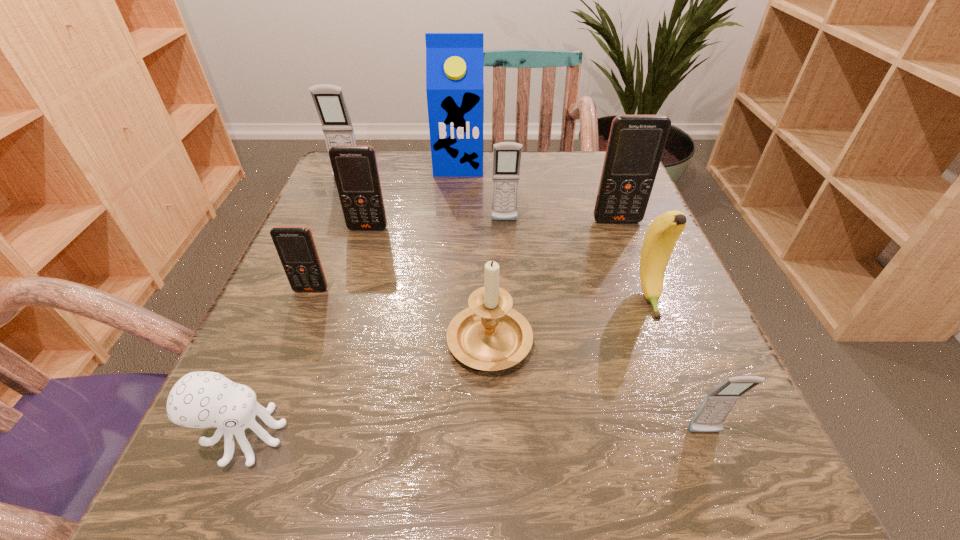
Image resolution: width=960 pixels, height=540 pixels. Identify the location of vacant area that lies between the sixth nearest object and the nearest gray cellular telephone. (537, 330).

Locate an element on the screen. The height and width of the screenshot is (540, 960). vacant area that lies between the farthest cellular telephone and the nearest orange cellular telephone is located at coordinates (329, 235).

Find the location of `vacant space that is in between the banana and the octopus`. vacant space that is in between the banana and the octopus is located at coordinates (446, 367).

Where is `vacant space that's between the white octopus and the rightmost orange cellular telephone`? This screenshot has width=960, height=540. vacant space that's between the white octopus and the rightmost orange cellular telephone is located at coordinates (430, 328).

I want to click on free point between the carton and the sixth nearest object, so coord(414,196).

Locate an element on the screen. The image size is (960, 540). vacant space in between the third nearest cellular telephone and the white octopus is located at coordinates (306, 332).

The width and height of the screenshot is (960, 540). Find the location of `empty location between the nearest orange cellular telephone and the farthest orange cellular telephone`. empty location between the nearest orange cellular telephone and the farthest orange cellular telephone is located at coordinates (465, 255).

You are a GUI agent. You are given a task and a screenshot of the screen. Output one action in this format:
    pyautogui.click(x=<x>, y=<y>)
    Task: Click on the vacant space in between the banana and the biggest orange cellular telephone
    Image resolution: width=960 pixels, height=540 pixels.
    Given the screenshot: What is the action you would take?
    pyautogui.click(x=633, y=259)

Find the location of a particular element. free space that is in between the second smallest orange cellular telephone and the smallest orange cellular telephone is located at coordinates (340, 259).

Identify which object is the fifth nearest to the octopus. Please provide its 2D coordinates. Your answer should be formatted as a tuple, i.e. [(x, y)], where the tuple contains the x and y coordinates of a point satisfying the conditions above.

[(716, 406)]